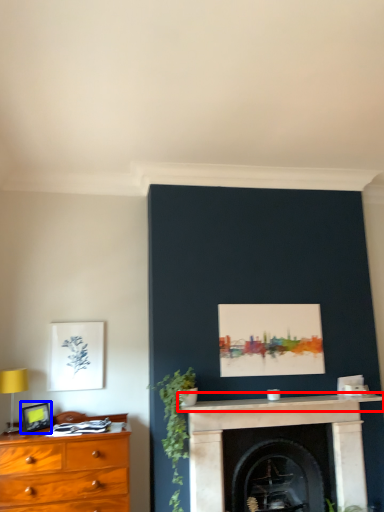
Question: Which of the following is the closest to the observer, mantle (highlighted by a red box) or picture frame (highlighted by a blue box)?

Choices:
 (A) mantle
 (B) picture frame

Answer: (A)